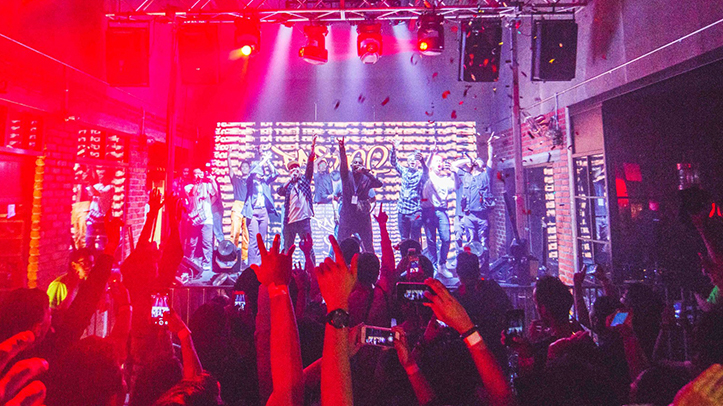
In order to click on window in this screenshot , I will do `click(594, 186)`.